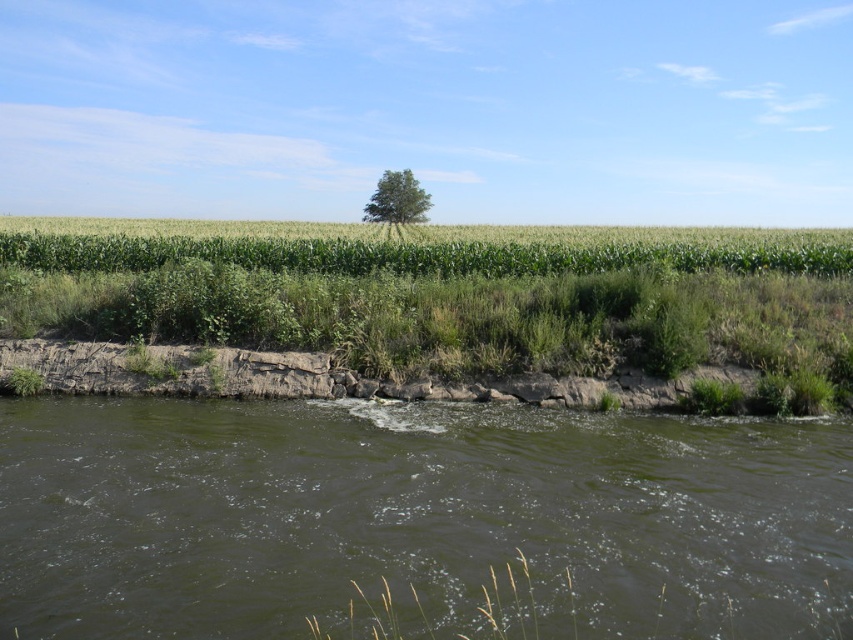
Question: Among these objects, which one is nearest to the camera?

Choices:
 (A) green leafy tree at center
 (B) green grassy field at center
 (C) dark green water at lower center

Answer: (C)

Question: Is green grassy field at center closer to camera compared to green leafy tree at center?

Choices:
 (A) yes
 (B) no

Answer: (A)

Question: Can you confirm if green grassy field at center is bigger than green leafy tree at center?

Choices:
 (A) no
 (B) yes

Answer: (A)

Question: Which of these objects is positioned farthest from the green grassy field at center?

Choices:
 (A) green leafy tree at center
 (B) dark green water at lower center

Answer: (A)

Question: Is dark green water at lower center to the left of green leafy tree at center from the viewer's perspective?

Choices:
 (A) no
 (B) yes

Answer: (A)

Question: Which object appears farthest from the camera in this image?

Choices:
 (A) green grassy field at center
 (B) dark green water at lower center

Answer: (A)